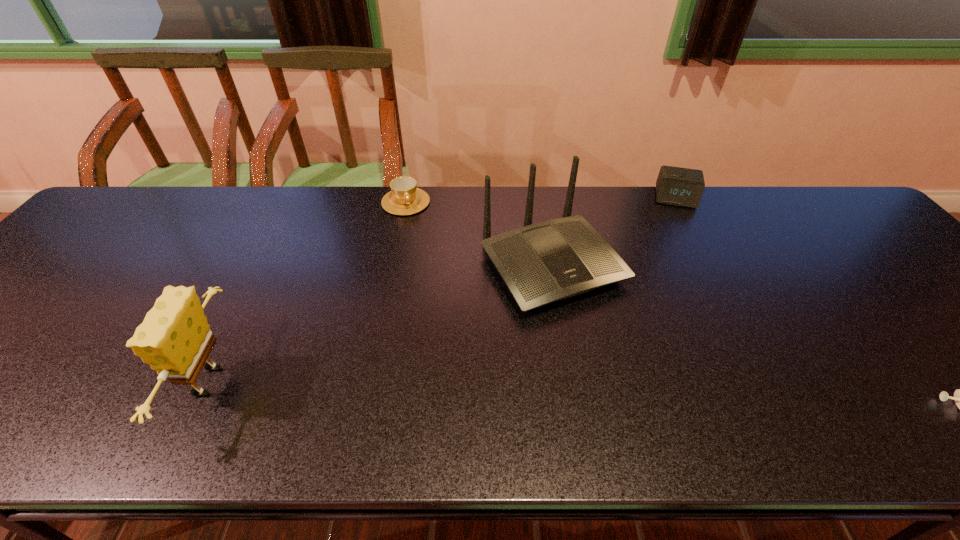
At what (x,y) coordinates should I click in order to perform the action: click on free spot on the desktop that is between the sponge and the syringe and is positioned with the handle on the side of the second shortest object. Please return your answer as a coordinate pair (x, y). This screenshot has width=960, height=540. Looking at the image, I should click on (480, 392).

Locate an element on the screen. The height and width of the screenshot is (540, 960). free space on the desktop that is between the leftmost object and the shortest object and is positioned on the front-facing side of the third nearest object is located at coordinates (655, 398).

Identify the location of free space on the desktop that is between the leftmost object and the shortest object and is positioned on the front-facing side of the fourth object from left to right. (x=692, y=399).